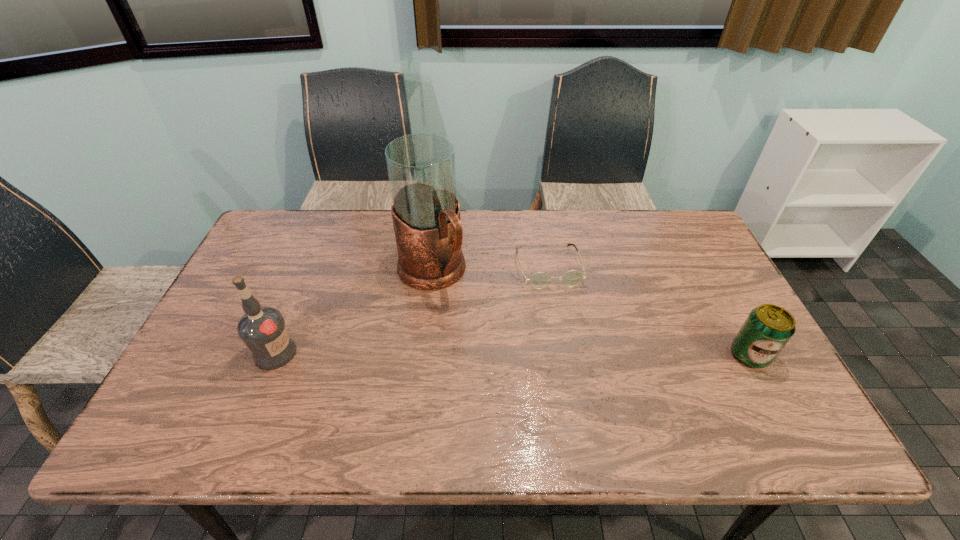
Find the location of a particular element. the second tallest object is located at coordinates (262, 329).

Identify the location of vodka. This screenshot has height=540, width=960. (262, 329).

The image size is (960, 540). What are the coordinates of `beer can` in the screenshot? It's located at (767, 329).

Where is `the rightmost object`? This screenshot has height=540, width=960. the rightmost object is located at coordinates (767, 329).

At what (x,y) coordinates should I click in order to perform the action: click on the second object from left to right. Please return your answer as a coordinate pair (x, y). This screenshot has width=960, height=540. Looking at the image, I should click on (425, 211).

The width and height of the screenshot is (960, 540). I want to click on the tallest object, so click(x=425, y=211).

Image resolution: width=960 pixels, height=540 pixels. I want to click on the shortest object, so click(539, 280).

In order to click on the third object from left to right in this screenshot , I will do `click(539, 280)`.

The width and height of the screenshot is (960, 540). Identify the location of free point located 0.090m on the front label of the vodka. (331, 353).

Image resolution: width=960 pixels, height=540 pixels. I want to click on vacant space situated on the back of the beer can, so click(732, 322).